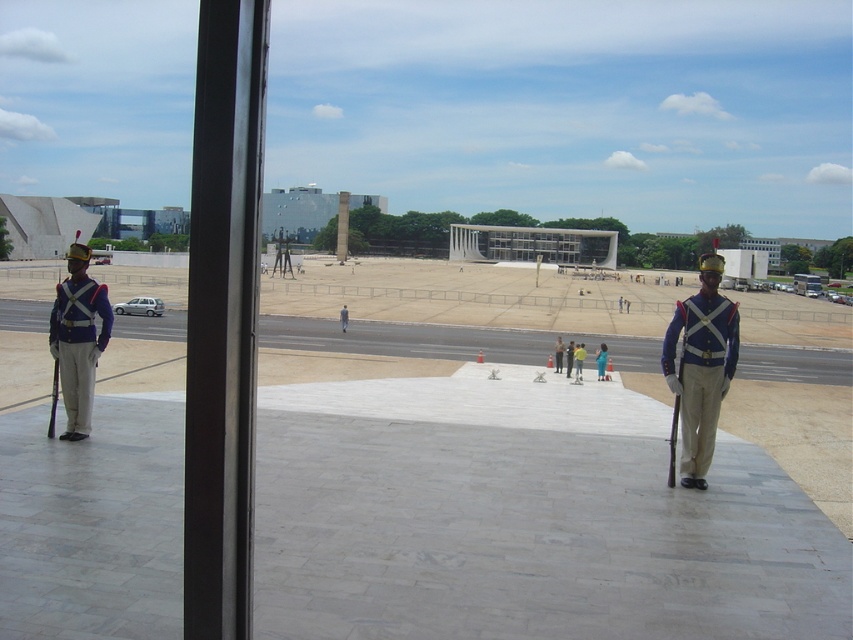
Does shiny blue uniform at left come in front of blue uniformed guard at center?

Yes, it is in front of blue uniformed guard at center.

Which of these two, shiny blue uniform at left or blue uniformed guard at center, stands shorter?

shiny blue uniform at left

I want to click on shiny blue uniform at left, so click(x=78, y=346).

Is light blue uniform at center to the left of blue uniformed person at center from the viewer's perspective?

In fact, light blue uniform at center is to the right of blue uniformed person at center.

Which is in front, point (579, 374) or point (572, 364)?

Point (579, 374) is in front.

Where is `light blue uniform at center`? The width and height of the screenshot is (853, 640). light blue uniform at center is located at coordinates 578,360.

Is blue uniformed guard at center positioned behind camouflage uniform at center?

No, it is not.

Is point (596, 362) farther from viewer compared to point (555, 348)?

No, (596, 362) is closer to viewer.

Is point (596, 371) closer to camera compared to point (556, 352)?

Yes, point (596, 371) is in front of point (556, 352).

The height and width of the screenshot is (640, 853). Identify the location of blue uniformed guard at center. (601, 360).